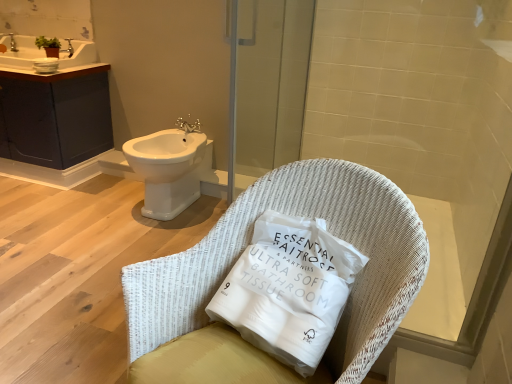
Question: Is silver metallic faucet at upper center bigger or smaller than white glossy bidet at left?

Choices:
 (A) big
 (B) small

Answer: (B)

Question: Considering the positions of silver metallic faucet at upper center and white glossy bidet at left in the image, is silver metallic faucet at upper center taller or shorter than white glossy bidet at left?

Choices:
 (A) short
 (B) tall

Answer: (A)

Question: Which is farther from the white ceramic sink at upper left?

Choices:
 (A) white glossy bidet at left
 (B) dark gray matte cabinet at upper left
 (C) silver metallic faucet at upper center
 (D) transparent glass screen door at upper center
 (E) white woven pillow at center

Answer: (E)

Question: Which object is positioned farthest from the white ceramic sink at upper left?

Choices:
 (A) silver metallic faucet at upper center
 (B) dark gray matte cabinet at upper left
 (C) white wicker chair at center
 (D) white glossy bidet at left
 (E) transparent glass screen door at upper center

Answer: (C)